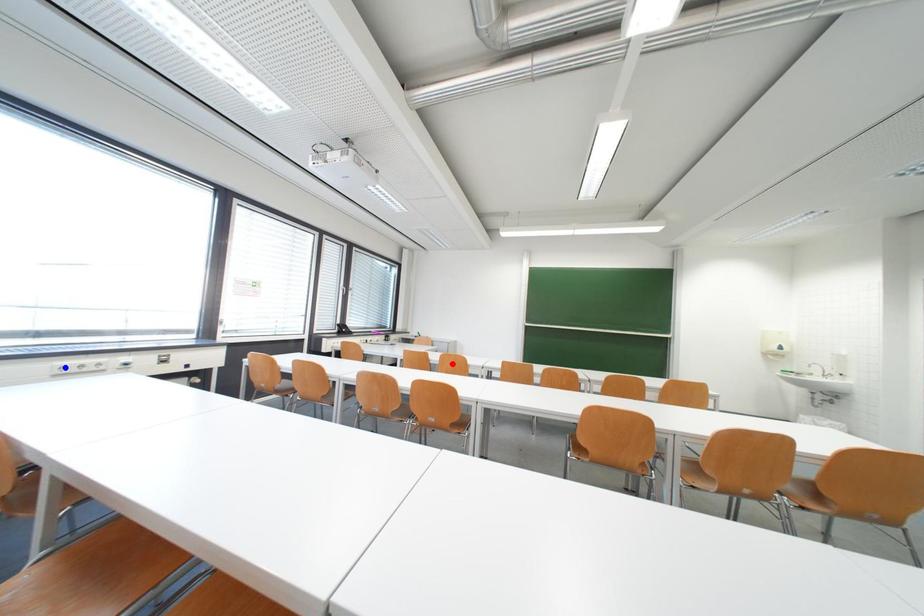
Question: Two points are marked on the image. Which point is closer to the camera?

Choices:
 (A) Blue point is closer.
 (B) Red point is closer.

Answer: (A)